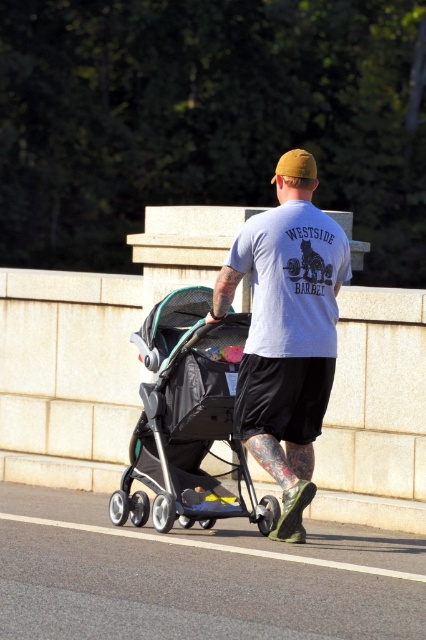
You are a photographer trying to capture the stroller in the center of your image. The camera you are using has a focus point at coordinate (187, 419). Will this focus point align with the black textured stroller at center?

Yes, the point (187, 419) marks the black textured stroller at center, so the focus point will align with it.